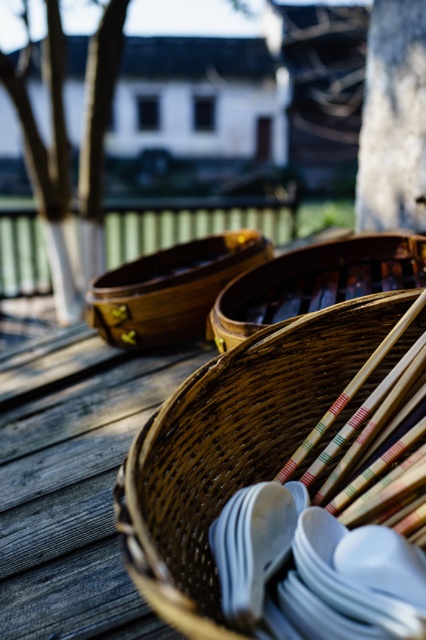
Who is taller, green leafy tree at left or wooden canoe at center?

green leafy tree at left

What do you see at coordinates (69, 152) in the screenshot? This screenshot has width=426, height=640. I see `green leafy tree at left` at bounding box center [69, 152].

Find the location of a particular element. This screenshot has width=426, height=640. green leafy tree at left is located at coordinates (69, 152).

At what (x,y) coordinates should I click in order to perform the action: click on green leafy tree at left. Please return your answer as a coordinate pair (x, y). Looking at the image, I should click on (69, 152).

Does wooden canoe at center have a smaller size compared to wooden chopsticks at center?

Actually, wooden canoe at center might be larger than wooden chopsticks at center.

Find the location of a particular element. The image size is (426, 640). wooden canoe at center is located at coordinates (169, 289).

This screenshot has height=640, width=426. What are the coordinates of `wooden canoe at center` in the screenshot? It's located at (169, 289).

Does woven bamboo basket at center come in front of gray rough bark at upper right?

Yes, woven bamboo basket at center is closer to the viewer.

Between woven bamboo basket at center and gray rough bark at upper right, which one is positioned higher?

gray rough bark at upper right is above.

Describe the element at coordinates (232, 445) in the screenshot. I see `woven bamboo basket at center` at that location.

Find the location of a particular element. The height and width of the screenshot is (640, 426). woven bamboo basket at center is located at coordinates (232, 445).